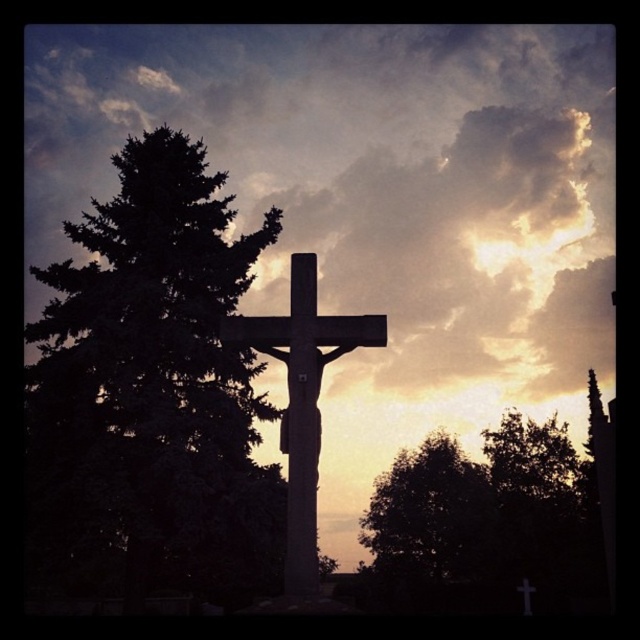
You are an artist trying to paint the scene. You want to ensure that the cloudy sky at upper center and the smooth stone cross at center are positioned correctly. According to the description, which object is closer to the viewer?

The cloudy sky at upper center is closer to the viewer than the smooth stone cross at center.

In the scene shown: You are an artist trying to sketch the scene. You notice the dark green leafy tree at lower right and the smooth stone cross at center. Which object is located to the left of the other?

The dark green leafy tree at lower right is positioned on the left side of smooth stone cross at center.